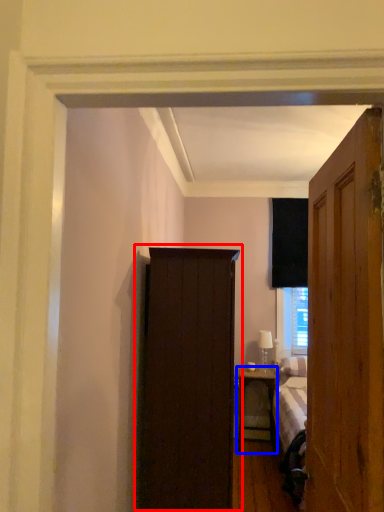
Question: Which object appears farthest to the camera in this image, cupboard (highlighted by a red box) or nightstand (highlighted by a blue box)?

Choices:
 (A) cupboard
 (B) nightstand

Answer: (B)